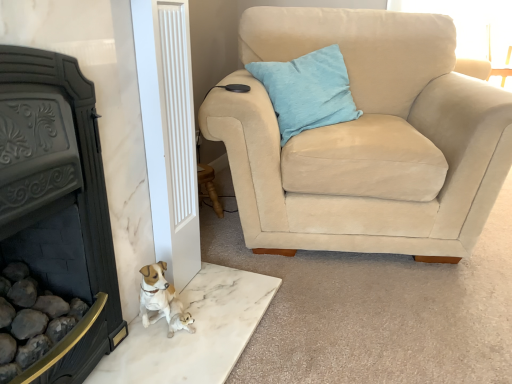
Question: Is beige suede armchair at upper right at the back of light blue fabric pillow at upper right?

Choices:
 (A) no
 (B) yes

Answer: (B)

Question: Does light blue fabric pillow at upper right have a lesser width compared to beige suede armchair at upper right?

Choices:
 (A) no
 (B) yes

Answer: (B)

Question: From the image's perspective, is light blue fabric pillow at upper right located beneath beige suede armchair at upper right?

Choices:
 (A) yes
 (B) no

Answer: (B)

Question: From a real-world perspective, is light blue fabric pillow at upper right on beige suede armchair at upper right?

Choices:
 (A) yes
 (B) no

Answer: (A)

Question: Is the position of light blue fabric pillow at upper right less distant than that of beige suede armchair at upper right?

Choices:
 (A) no
 (B) yes

Answer: (A)

Question: Could you tell me if light blue fabric pillow at upper right is facing beige suede armchair at upper right?

Choices:
 (A) yes
 (B) no

Answer: (A)

Question: Can you confirm if black cast iron fireplace at left is bigger than beige suede armchair at upper right?

Choices:
 (A) yes
 (B) no

Answer: (B)

Question: Does black cast iron fireplace at left have a greater width compared to beige suede armchair at upper right?

Choices:
 (A) yes
 (B) no

Answer: (B)

Question: Is black cast iron fireplace at left aimed at beige suede armchair at upper right?

Choices:
 (A) yes
 (B) no

Answer: (B)

Question: Is black cast iron fireplace at left shorter than beige suede armchair at upper right?

Choices:
 (A) no
 (B) yes

Answer: (B)

Question: Is black cast iron fireplace at left positioned far away from beige suede armchair at upper right?

Choices:
 (A) yes
 (B) no

Answer: (B)

Question: Is black cast iron fireplace at left thinner than beige suede armchair at upper right?

Choices:
 (A) yes
 (B) no

Answer: (A)

Question: Considering the relative positions of beige suede armchair at upper right and light blue fabric pillow at upper right in the image provided, is beige suede armchair at upper right behind light blue fabric pillow at upper right?

Choices:
 (A) yes
 (B) no

Answer: (B)